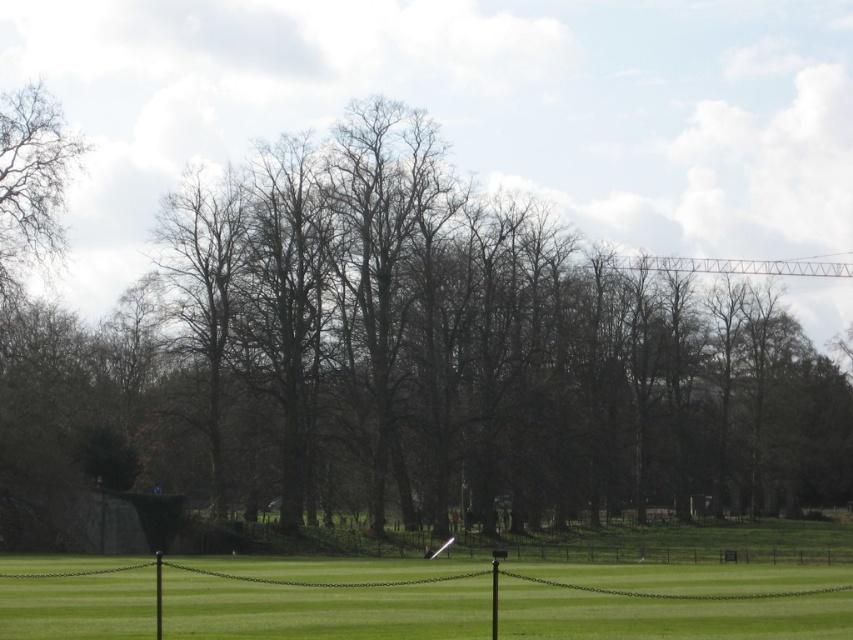
Is brown leafless tree at center shorter than green grass at center?

No.

Between brown leafless tree at center and green grass at center, which one has less height?

With less height is green grass at center.

Who is more forward, (0, 240) or (740, 620)?

Point (740, 620) is more forward.

You are a GUI agent. You are given a task and a screenshot of the screen. Output one action in this format:
    pyautogui.click(x=<x>, y=<y>)
    Task: Click on the brown leafless tree at center
    
    Given the screenshot: What is the action you would take?
    pyautogui.click(x=393, y=353)

Can you confirm if brown leafless tree at center is shorter than bare branches at left?

No.

Is point (697, 401) closer to viewer compared to point (45, 252)?

No, it is not.

I want to click on brown leafless tree at center, so click(393, 353).

Is green grass at center to the left of bare branches at left from the viewer's perspective?

Incorrect, green grass at center is not on the left side of bare branches at left.

Which of these two, green grass at center or bare branches at left, stands shorter?

bare branches at left

Identify the location of green grass at center. (672, 602).